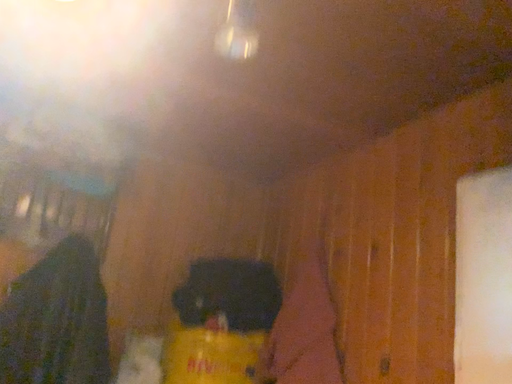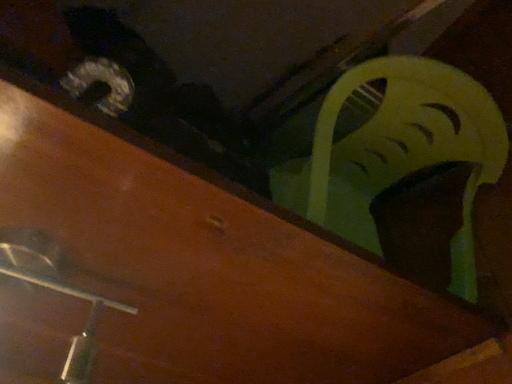
Question: How did the camera likely rotate when shooting the video?

Choices:
 (A) rotated left
 (B) rotated right

Answer: (B)